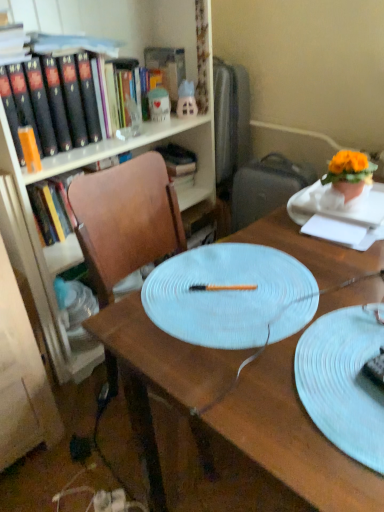
The height and width of the screenshot is (512, 384). I want to click on vacant space that is to the left of white paper at upper right, so click(x=279, y=245).